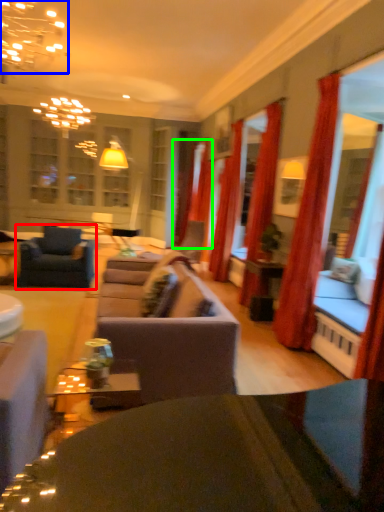
Question: Based on their relative distances, which object is farther from chair (highlighted by a red box)? Choose from light fixture (highlighted by a blue box) and curtain (highlighted by a green box).

Choices:
 (A) light fixture
 (B) curtain

Answer: (B)